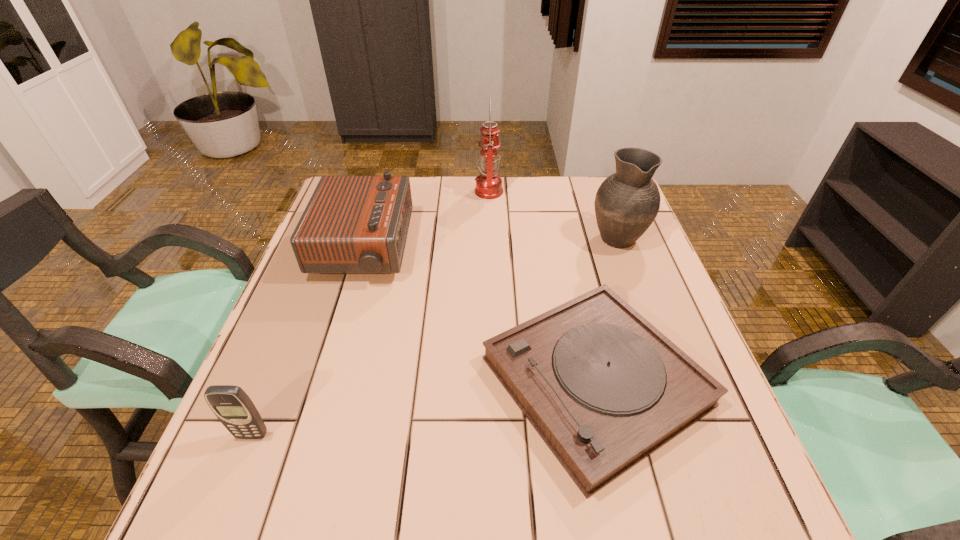
You are a GUI agent. You are given a task and a screenshot of the screen. Output one action in this format:
    pyautogui.click(x=<x>, y=<y>)
    Task: Click on the vacant space that satisfies the following two spatial constraints: 1. on the front panel of the radio receiver; 2. on the screen of the cellular telephone
    Image resolution: width=960 pixels, height=540 pixels.
    Given the screenshot: What is the action you would take?
    pyautogui.click(x=306, y=435)

Locate an element on the screen. vacant space that satisfies the following two spatial constraints: 1. on the front panel of the radio receiver; 2. on the screen of the cellular telephone is located at coordinates (306, 435).